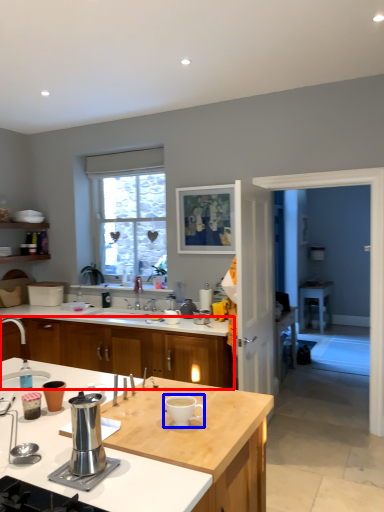
Question: Among these objects, which one is nearest to the camera, cabinetry (highlighted by a red box) or coffee cup (highlighted by a blue box)?

Choices:
 (A) cabinetry
 (B) coffee cup

Answer: (B)